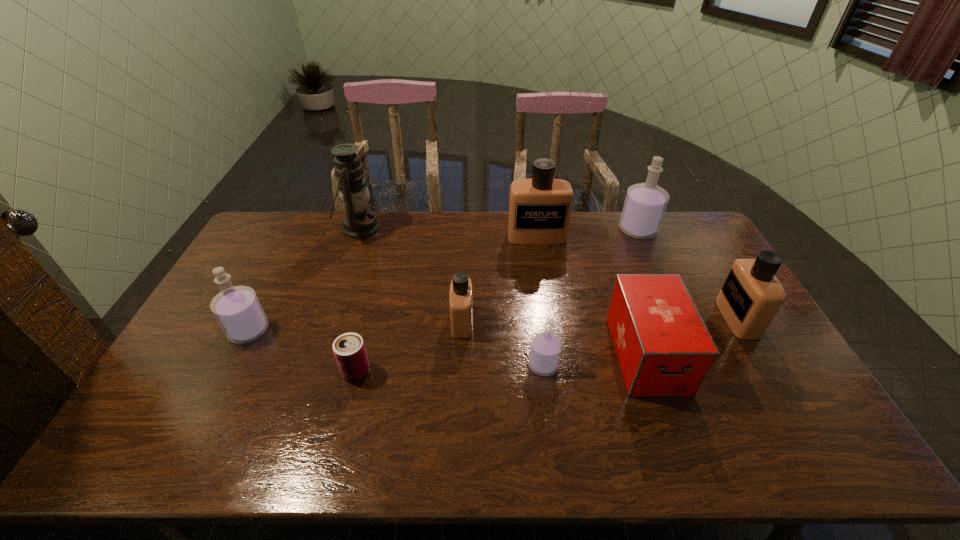
Identify the location of the leftmost beige perfume. The image size is (960, 540). (461, 292).

In order to click on the smallest beige perfume in this screenshot , I will do `click(461, 292)`.

This screenshot has width=960, height=540. Find the location of `the smallest purple perfume`. the smallest purple perfume is located at coordinates (545, 350).

The height and width of the screenshot is (540, 960). I want to click on the second purple perfume from right to left, so click(545, 350).

I want to click on the first-aid kit, so pos(664,349).

At what (x,y) coordinates should I click in order to perform the action: click on pink can. Please return your answer as a coordinate pair (x, y). Image resolution: width=960 pixels, height=540 pixels. Looking at the image, I should click on pyautogui.click(x=349, y=349).

In order to click on the shortest object in this screenshot , I will do `click(349, 349)`.

Where is `free location located on the front of the eighth object from right to left`? free location located on the front of the eighth object from right to left is located at coordinates (337, 293).

The height and width of the screenshot is (540, 960). Find the location of `free spot located on the front label of the second beige perfume from right to left`. free spot located on the front label of the second beige perfume from right to left is located at coordinates (x=540, y=254).

Where is `vacant space located 0.060m on the right of the rightmost purple perfume`? vacant space located 0.060m on the right of the rightmost purple perfume is located at coordinates (673, 230).